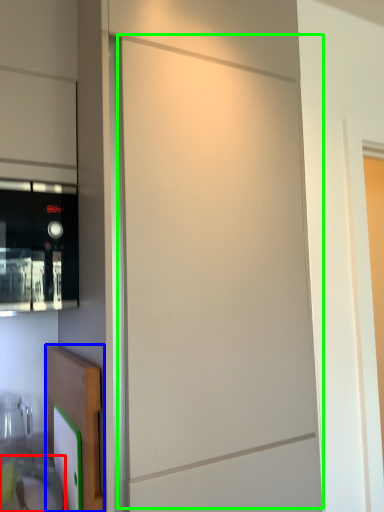
Question: Which object is positioned closest to sink (highlighted by a red box)? Select from cabinetry (highlighted by a blue box) and screen door (highlighted by a green box).

Choices:
 (A) cabinetry
 (B) screen door

Answer: (A)